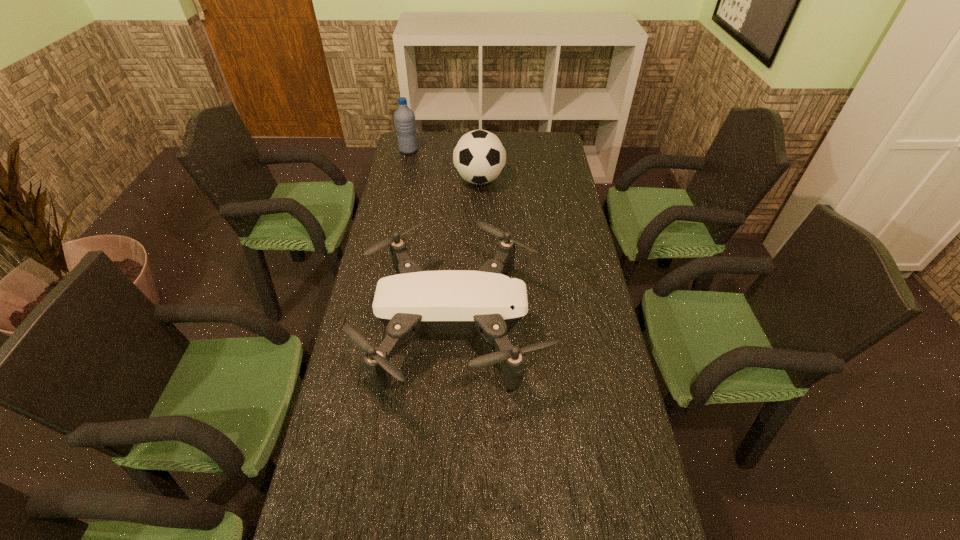
Locate an element on the screen. The image size is (960, 540). the farthest object is located at coordinates (404, 117).

In order to click on the second nearest object in this screenshot , I will do `click(479, 156)`.

The width and height of the screenshot is (960, 540). What are the coordinates of `the shortest object` in the screenshot? It's located at (487, 302).

Find the location of a particular element. The image size is (960, 540). drone is located at coordinates (487, 302).

Where is `free location located 0.100m on the front of the water bottle`? The width and height of the screenshot is (960, 540). free location located 0.100m on the front of the water bottle is located at coordinates (405, 168).

Image resolution: width=960 pixels, height=540 pixels. Identify the location of vacant space located on the front of the second farthest object. (480, 211).

Locate an element on the screen. This screenshot has width=960, height=540. blank space located on the camera side of the shortest object is located at coordinates (587, 326).

The height and width of the screenshot is (540, 960). Find the location of `object that is at the far edge`. object that is at the far edge is located at coordinates (404, 117).

Locate an element on the screen. The width and height of the screenshot is (960, 540). water bottle located at the left edge is located at coordinates (404, 117).

Where is `drone at the left edge`? The width and height of the screenshot is (960, 540). drone at the left edge is located at coordinates (487, 302).